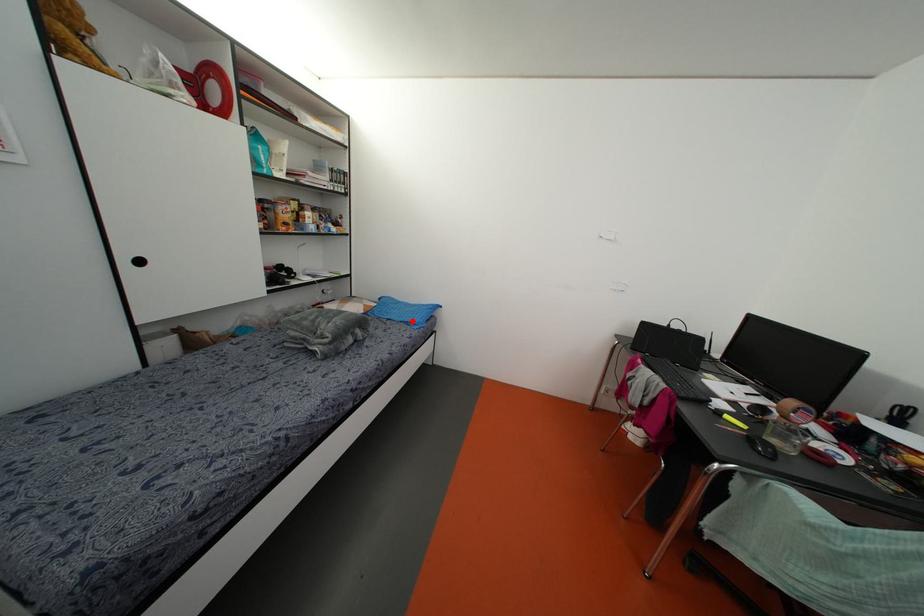
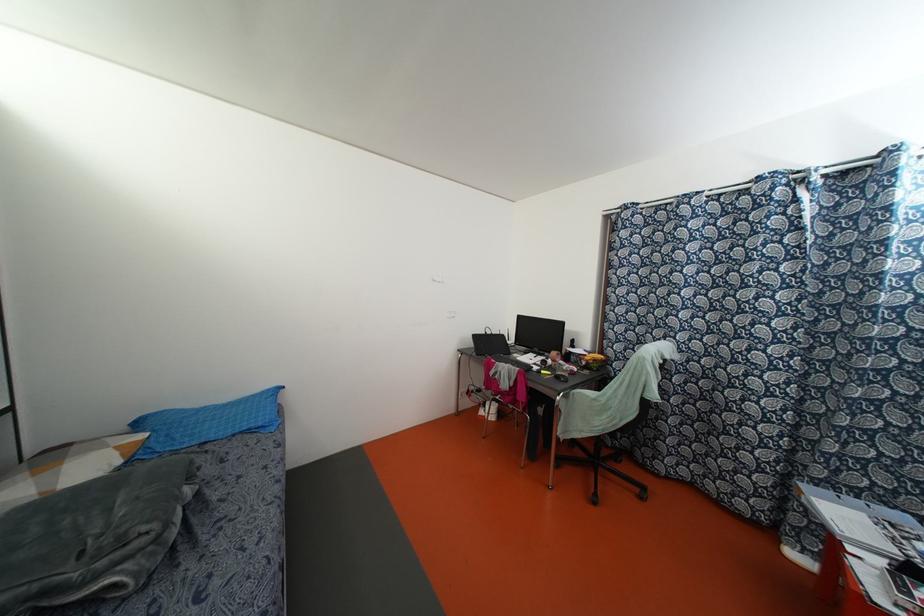
Question: A red point is marked in image1. In image2, is the corresponding 3D point closer to the camera or farther? Reply with the corresponding letter.

Choices:
 (A) The corresponding 3D point is closer.
 (B) The corresponding 3D point is farther.

Answer: (A)